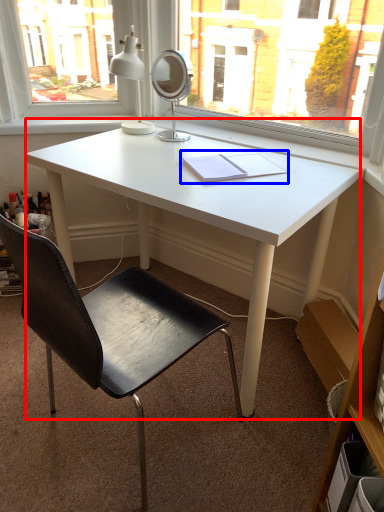
Question: Which point is further to the camera, desk (highlighted by a red box) or notebook (highlighted by a blue box)?

Choices:
 (A) desk
 (B) notebook

Answer: (B)